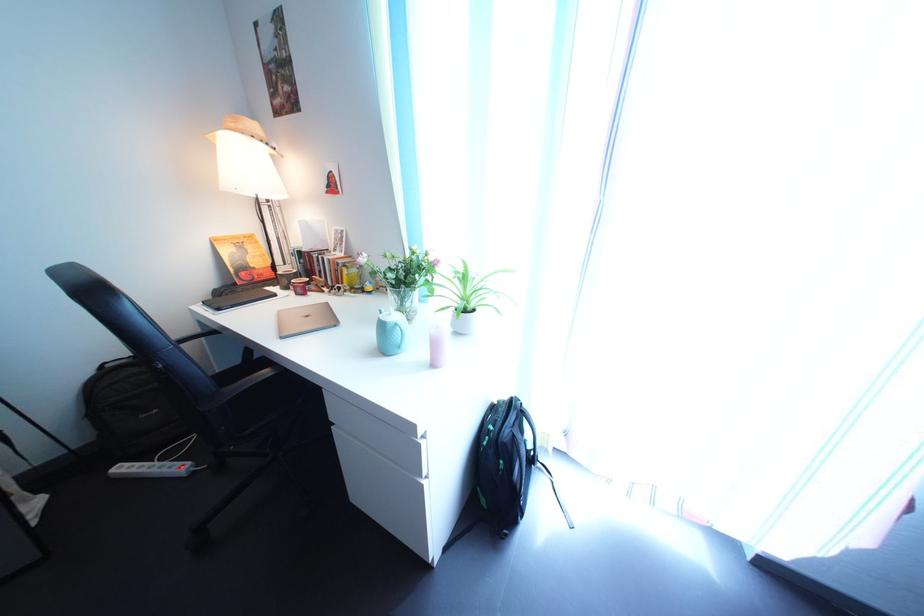
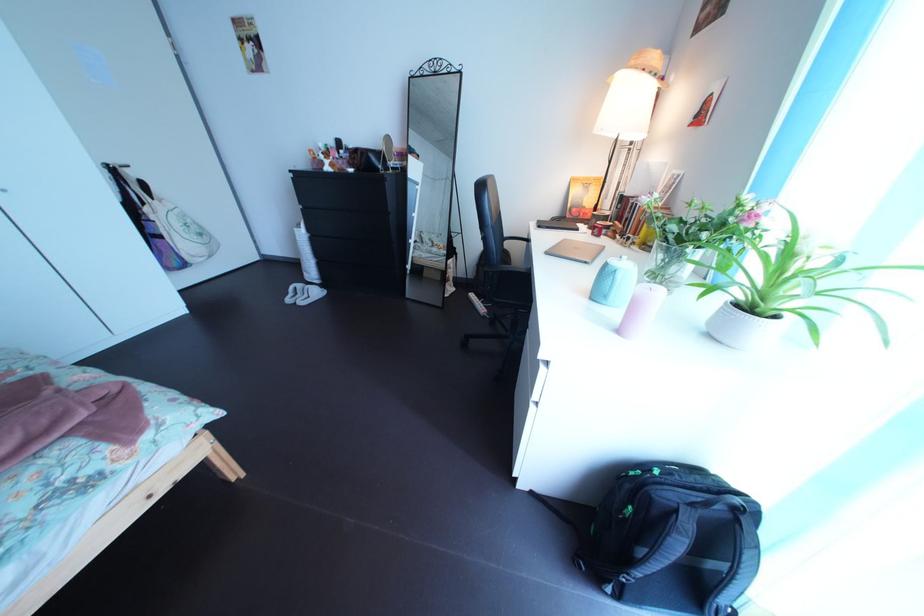
Find the pixel in the second image that matches the point at 482,318 in the first image.

(773, 318)